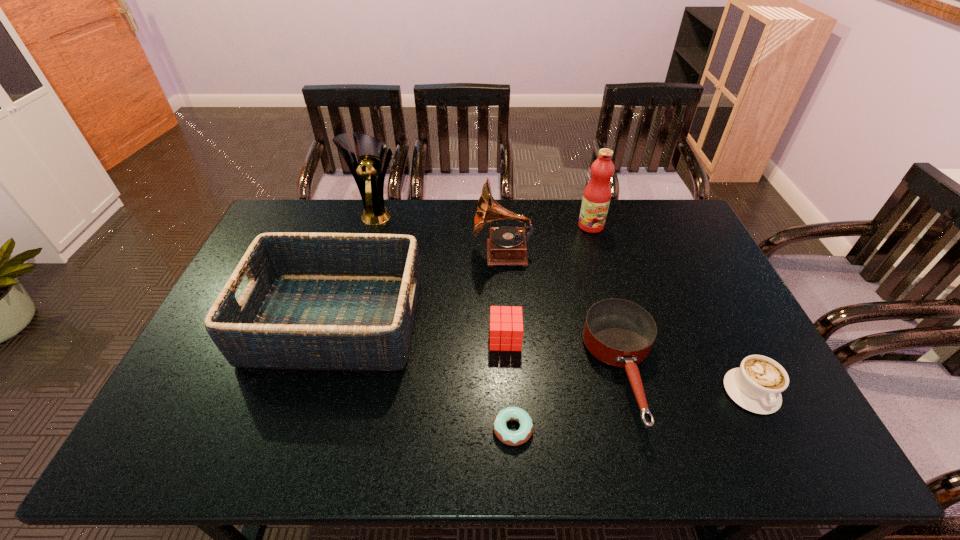
Locate an element on the screen. pan located in the near edge section of the desktop is located at coordinates (620, 333).

Find the location of `doughnut present at the near edge`. doughnut present at the near edge is located at coordinates (513, 438).

This screenshot has height=540, width=960. What are the coordinates of `object located at the left edge` in the screenshot? It's located at (314, 301).

The width and height of the screenshot is (960, 540). What are the coordinates of `object present at the right edge` in the screenshot? It's located at (756, 386).

At what (x,y) coordinates should I click in order to perform the action: click on vacant space at the far edge of the desktop. Please return your answer as a coordinate pair (x, y). Image resolution: width=960 pixels, height=540 pixels. Looking at the image, I should click on (625, 203).

You are a GUI agent. You are given a task and a screenshot of the screen. Output one action in this format:
    pyautogui.click(x=<x>, y=<y>)
    Task: Click on the free space at the near edge
    The width and height of the screenshot is (960, 540).
    Given the screenshot: What is the action you would take?
    tap(679, 428)

This screenshot has width=960, height=540. I want to click on free space at the left edge, so 225,423.

Where is `free space at the right edge of the desktop`? Image resolution: width=960 pixels, height=540 pixels. free space at the right edge of the desktop is located at coordinates (706, 354).

The height and width of the screenshot is (540, 960). I want to click on vacant space at the far left corner of the desktop, so click(x=282, y=226).

The width and height of the screenshot is (960, 540). I want to click on free region at the near right corner, so click(756, 453).